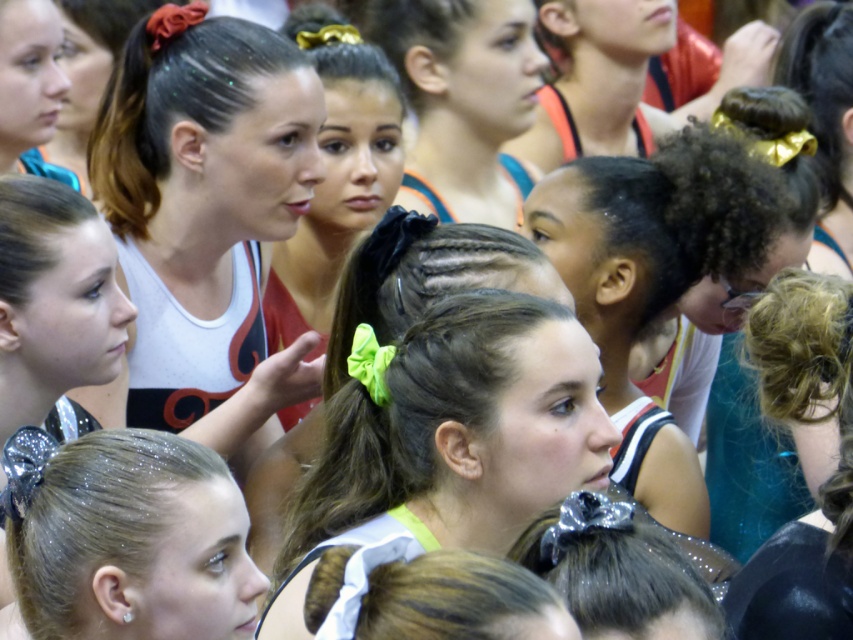
Question: Can you confirm if teal shiny hair at center is positioned to the left of sparkly silver hair clip at lower left?

Choices:
 (A) no
 (B) yes

Answer: (A)

Question: Does green satin bow at center appear over white satin ribbon at center?

Choices:
 (A) yes
 (B) no

Answer: (A)

Question: Based on their relative distances, which object is farther from the sparkly silver hair clip at lower left?

Choices:
 (A) curly blonde hair at lower right
 (B) black curly hair at center
 (C) matte white tank top at upper left

Answer: (C)

Question: Among these objects, which one is nearest to the camera?

Choices:
 (A) shiny dark brown hair at center
 (B) curly black hair at upper right
 (C) curly blonde hair at lower right
 (D) gold shiny hair clip at upper right

Answer: (C)

Question: Considering the relative positions of matte white tank top at center and black curly hair at center in the image provided, where is matte white tank top at center located with respect to black curly hair at center?

Choices:
 (A) left
 (B) right

Answer: (A)

Question: Which of the following is the farthest from the observer?

Choices:
 (A) (525, 64)
 (B) (177, 470)

Answer: (A)